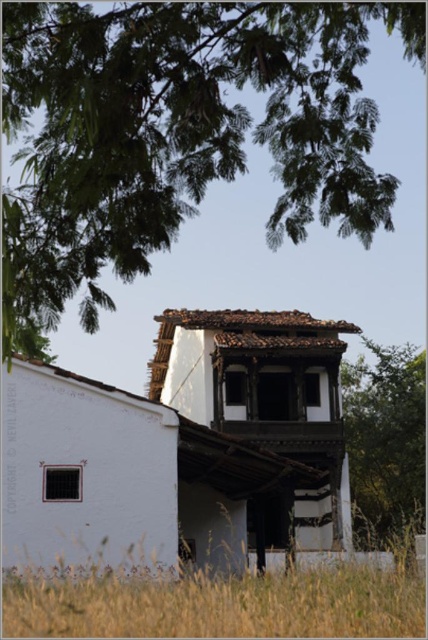
Question: Can you confirm if green leafy tree at upper center is bigger than green leafy tree at center?

Choices:
 (A) yes
 (B) no

Answer: (B)

Question: Is green grass at lower left wider than green leafy tree at center?

Choices:
 (A) yes
 (B) no

Answer: (A)

Question: From the image, what is the correct spatial relationship of green grass at lower left in relation to green leafy tree at center?

Choices:
 (A) left
 (B) right

Answer: (A)

Question: Which point is farther from the camera taking this photo?

Choices:
 (A) (272, 593)
 (B) (392, 362)

Answer: (B)

Question: Which point is closer to the camera?

Choices:
 (A) green leafy tree at center
 (B) green leafy tree at upper center
 (C) green grass at lower left

Answer: (B)

Question: Which point is closer to the camera?

Choices:
 (A) (344, 413)
 (B) (189, 93)
 (C) (419, 576)

Answer: (B)